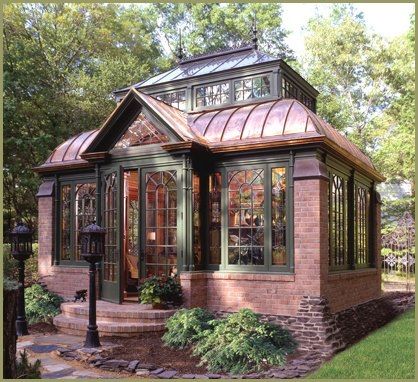
What are the coordinates of `front door` in the screenshot? It's located at (118, 295), (143, 265).